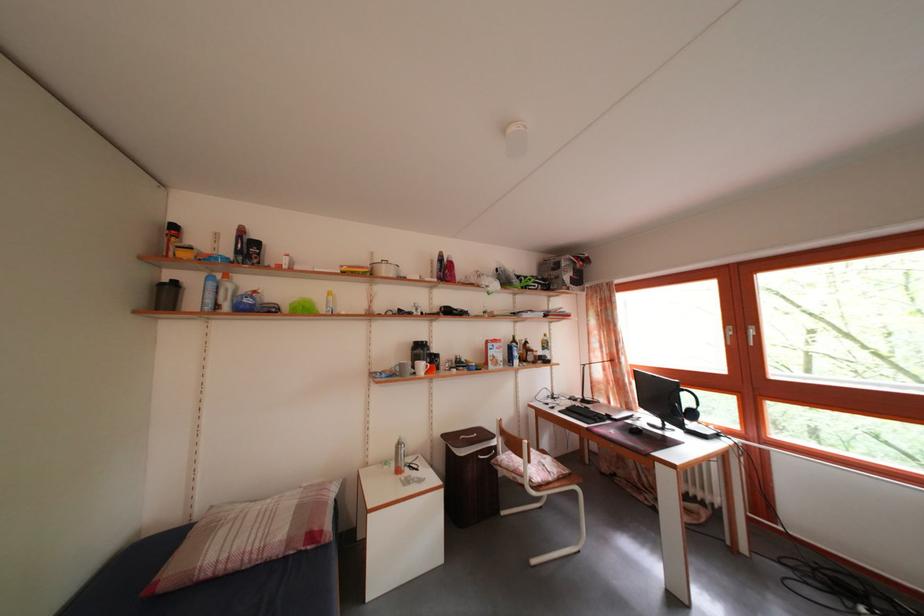
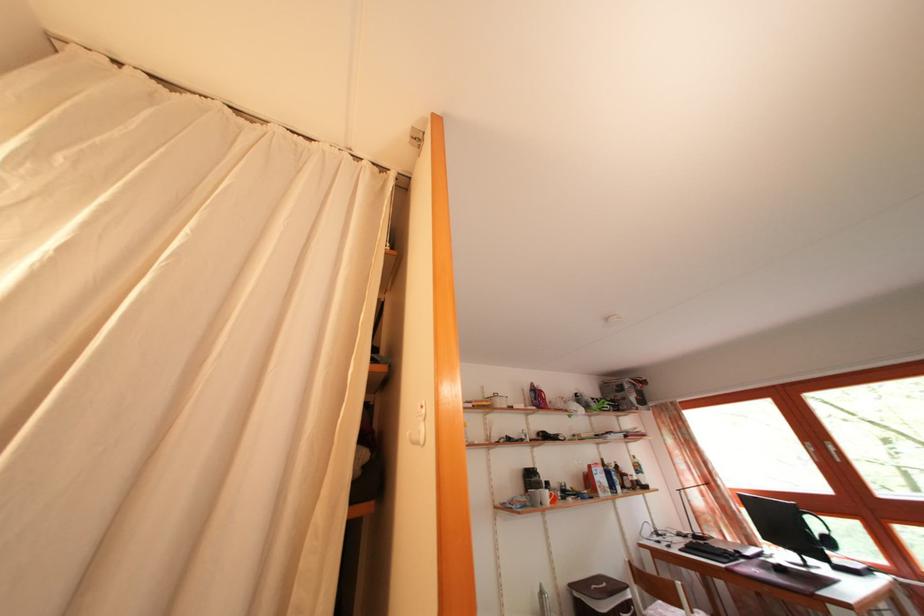
The point at (541, 355) is marked in the first image. Where is the corresponding point in the second image?

(636, 480)